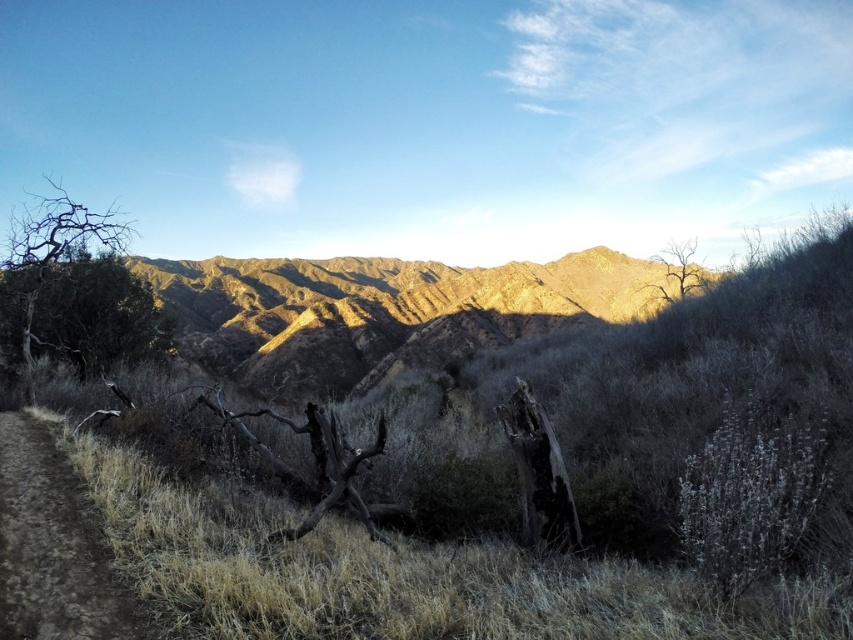
Question: Does brown dirt track at lower left appear on the left side of bare wood tree at left?

Choices:
 (A) yes
 (B) no

Answer: (B)

Question: Which of the following is the closest to the observer?

Choices:
 (A) (231, 284)
 (B) (82, 317)
 (C) (3, 561)
 (D) (660, 289)

Answer: (C)

Question: Which of these objects is positioned closest to the bare wood tree at left?

Choices:
 (A) brown dirt track at lower left
 (B) brown rocky mountain range at center

Answer: (A)

Question: Which point is closer to the camera taking this photo?

Choices:
 (A) (25, 506)
 (B) (682, 250)

Answer: (A)

Question: Can you confirm if bare wood tree at left is bigger than bare wood tree at upper right?

Choices:
 (A) yes
 (B) no

Answer: (B)

Question: From the image, what is the correct spatial relationship of brown dirt track at lower left in relation to bare wood tree at left?

Choices:
 (A) right
 (B) left

Answer: (A)